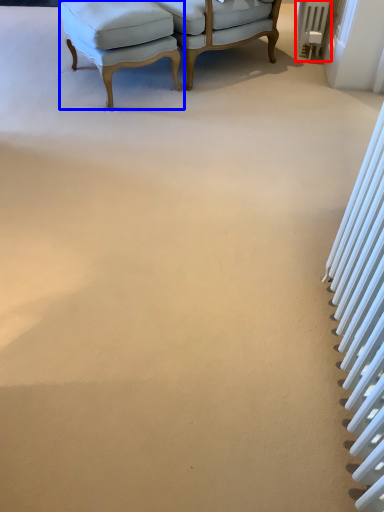
Question: Which of the following is the closest to the observer, radiator (highlighted by a red box) or chair (highlighted by a blue box)?

Choices:
 (A) radiator
 (B) chair

Answer: (B)